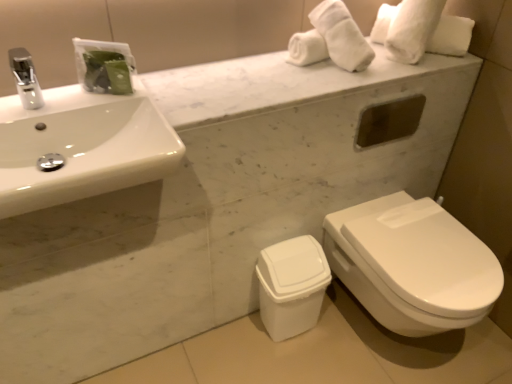
This screenshot has width=512, height=384. Find the location of `vacant area located to the right-hand side of silver metallic faucet at upper left`. vacant area located to the right-hand side of silver metallic faucet at upper left is located at coordinates (76, 104).